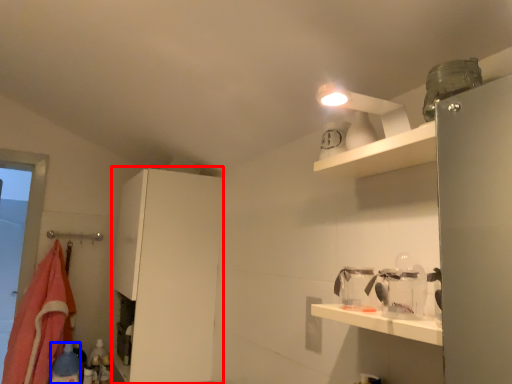
Question: Which object is further to the camera taking this photo, cabinetry (highlighted by a red box) or bottle (highlighted by a blue box)?

Choices:
 (A) cabinetry
 (B) bottle

Answer: (B)